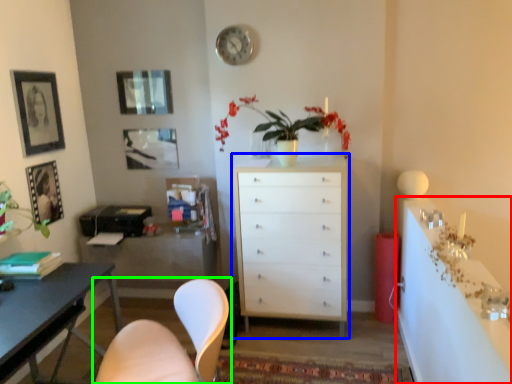
Question: Which object is positioned farthest from computer desk (highlighted by a red box)? Select from chest of drawers (highlighted by a blue box) and chair (highlighted by a green box).

Choices:
 (A) chest of drawers
 (B) chair

Answer: (B)